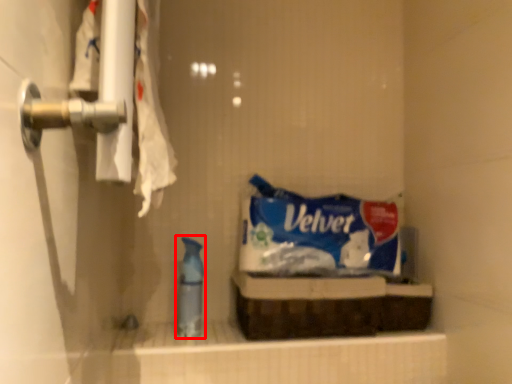
Question: From the image, what is the correct spatial relationship of cleaning product (annotated by the red box) in relation to snack?

Choices:
 (A) right
 (B) left

Answer: (B)